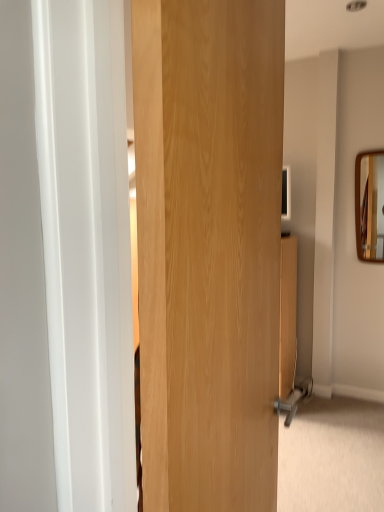
Question: Can you confirm if wooden frame mirror at upper right is shorter than wooden door at center?

Choices:
 (A) no
 (B) yes

Answer: (B)

Question: Is wooden frame mirror at upper right beside wooden door at center?

Choices:
 (A) no
 (B) yes

Answer: (A)

Question: Does wooden frame mirror at upper right lie behind wooden door at center?

Choices:
 (A) no
 (B) yes

Answer: (B)

Question: Does wooden frame mirror at upper right have a larger size compared to wooden door at center?

Choices:
 (A) yes
 (B) no

Answer: (B)

Question: Is wooden frame mirror at upper right closer to the viewer compared to wooden door at center?

Choices:
 (A) no
 (B) yes

Answer: (A)

Question: Is wooden frame mirror at upper right located outside wooden door at center?

Choices:
 (A) yes
 (B) no

Answer: (A)

Question: Does wooden door at center appear on the left side of wooden frame mirror at upper right?

Choices:
 (A) no
 (B) yes

Answer: (B)

Question: Considering the relative sizes of wooden door at center and wooden frame mirror at upper right in the image provided, is wooden door at center wider than wooden frame mirror at upper right?

Choices:
 (A) yes
 (B) no

Answer: (A)

Question: Does wooden door at center have a lesser height compared to wooden frame mirror at upper right?

Choices:
 (A) yes
 (B) no

Answer: (B)

Question: Considering the relative sizes of wooden door at center and wooden frame mirror at upper right in the image provided, is wooden door at center smaller than wooden frame mirror at upper right?

Choices:
 (A) no
 (B) yes

Answer: (A)

Question: Is wooden door at center turned away from wooden frame mirror at upper right?

Choices:
 (A) no
 (B) yes

Answer: (A)

Question: From the image's perspective, is wooden door at center on top of wooden frame mirror at upper right?

Choices:
 (A) no
 (B) yes

Answer: (A)

Question: In terms of width, does wooden door at center look wider or thinner when compared to wooden frame mirror at upper right?

Choices:
 (A) wide
 (B) thin

Answer: (A)